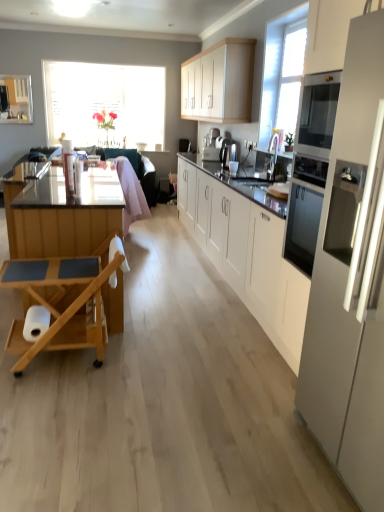
Find the location of `wooden rolling cart at left`. wooden rolling cart at left is located at coordinates (64, 301).

The image size is (384, 512). What are the coordinates of `white glossy refrigerator at right` in the screenshot? It's located at tap(351, 281).

The width and height of the screenshot is (384, 512). Find the location of `white glossy sink at center`. white glossy sink at center is located at coordinates (266, 166).

Image resolution: width=384 pixels, height=512 pixels. Describe the element at coordinates (131, 194) in the screenshot. I see `pink fabric swivel chair at center` at that location.

The height and width of the screenshot is (512, 384). I want to click on translucent glass window at upper left, so click(x=104, y=103).

This screenshot has height=512, width=384. Find the location of `wooden rolling cart at left`. wooden rolling cart at left is located at coordinates (64, 301).

Does satin silver coffee machine at center have a smaller size compared to white matte cabinet at center, which ranks as the second cabinetry in top-to-bottom order?

Correct, satin silver coffee machine at center occupies less space than white matte cabinet at center, which ranks as the second cabinetry in top-to-bottom order.

How distant is satin silver coffee machine at center from white matte cabinet at center, which ranks as the second cabinetry in top-to-bottom order?

satin silver coffee machine at center and white matte cabinet at center, which ranks as the second cabinetry in top-to-bottom order, are 3.47 feet apart.

Can you confirm if satin silver coffee machine at center is shorter than white matte cabinet at center, placed as the first cabinetry when sorted from bottom to top?

Correct, satin silver coffee machine at center is not as tall as white matte cabinet at center, placed as the first cabinetry when sorted from bottom to top.

From the image's perspective, between satin silver coffee machine at center and white matte cabinet at center, which ranks as the second cabinetry in top-to-bottom order, who is located below?

white matte cabinet at center, which ranks as the second cabinetry in top-to-bottom order, is shown below in the image.

Considering the sizes of objects white matte cabinet at center, which ranks as the second cabinetry in top-to-bottom order, and white glossy refrigerator at right in the image provided, who is taller, white matte cabinet at center, which ranks as the second cabinetry in top-to-bottom order, or white glossy refrigerator at right?

white glossy refrigerator at right is taller.

Is white matte cabinet at center, placed as the first cabinetry when sorted from bottom to top, completely or partially outside of white glossy refrigerator at right?

Absolutely, white matte cabinet at center, placed as the first cabinetry when sorted from bottom to top, is external to white glossy refrigerator at right.

Which is closer, [282,220] or [380,286]?

Point [282,220] appears to be farther away from the viewer than point [380,286].

From a real-world perspective, between white matte cabinet at center, which ranks as the second cabinetry in top-to-bottom order, and white glossy refrigerator at right, who is vertically higher?

white glossy refrigerator at right, from a real-world perspective.

Is satin silver coffee machine at center with white glossy refrigerator at right?

No.

From a real-world perspective, between satin silver coffee machine at center and white glossy refrigerator at right, who is vertically lower?

white glossy refrigerator at right.

In the scene shown: From the image's perspective, which is above, satin silver coffee machine at center or white glossy refrigerator at right?

satin silver coffee machine at center.

Which point is more forward, (x=233, y=141) or (x=368, y=31)?

Positioned in front is point (x=368, y=31).

From the image's perspective, which is below, white matte cabinet at center, which ranks as the second cabinetry in top-to-bottom order, or translucent glass window at upper left?

white matte cabinet at center, which ranks as the second cabinetry in top-to-bottom order.

Can you confirm if white matte cabinet at center, placed as the first cabinetry when sorted from bottom to top, is positioned to the right of translucent glass window at upper left?

Yes, white matte cabinet at center, placed as the first cabinetry when sorted from bottom to top, is to the right of translucent glass window at upper left.

Identify the location of the 2nd cabinetry positioned below the translucent glass window at upper left (from the image's perspective). The height and width of the screenshot is (512, 384). (246, 250).

Between white matte cabinet at center, which ranks as the second cabinetry in top-to-bottom order, and translucent glass window at upper left, which one is positioned behind?

translucent glass window at upper left is more distant.

Considering the sizes of objects wooden rolling cart at left and satin silver coffee machine at center in the image provided, who is smaller, wooden rolling cart at left or satin silver coffee machine at center?

satin silver coffee machine at center is smaller.

Which object is further away from the camera taking this photo, wooden rolling cart at left or satin silver coffee machine at center?

satin silver coffee machine at center is further from the camera.

From the image's perspective, is wooden rolling cart at left above or below satin silver coffee machine at center?

wooden rolling cart at left is situated lower than satin silver coffee machine at center in the image.

Is wooden rolling cart at left turned away from satin silver coffee machine at center?

No.

Considering the sizes of objects white matte cabinet at upper center, positioned as the 1th cabinetry in top-to-bottom order, and satin silver coffee machine at center in the image provided, who is taller, white matte cabinet at upper center, positioned as the 1th cabinetry in top-to-bottom order, or satin silver coffee machine at center?

With more height is white matte cabinet at upper center, positioned as the 1th cabinetry in top-to-bottom order.

Is white matte cabinet at upper center, which is the 2th cabinetry from bottom to top, directly adjacent to satin silver coffee machine at center?

No, white matte cabinet at upper center, which is the 2th cabinetry from bottom to top, is not beside satin silver coffee machine at center.

Looking at this image, from the image's perspective, is white matte cabinet at upper center, which is the 2th cabinetry from bottom to top, located above satin silver coffee machine at center?

Yes, from the image's perspective, white matte cabinet at upper center, which is the 2th cabinetry from bottom to top, is above satin silver coffee machine at center.

Does white matte cabinet at upper center, positioned as the 1th cabinetry in top-to-bottom order, turn towards satin silver coffee machine at center?

No.

Could wooden rolling cart at left be considered to be inside white glossy sink at center?

No, wooden rolling cart at left is not a part of white glossy sink at center.

Is white glossy sink at center not near wooden rolling cart at left?

Indeed, white glossy sink at center is not near wooden rolling cart at left.

From the image's perspective, relative to wooden rolling cart at left, is white glossy sink at center above or below?

Based on their image positions, white glossy sink at center is located above wooden rolling cart at left.

You are a GUI agent. You are given a task and a screenshot of the screen. Output one action in this format:
    pyautogui.click(x=<x>, y=<y>)
    Task: Click on the cabinetry in front of the satin silver coffee machine at center
    
    Given the screenshot: What is the action you would take?
    pyautogui.click(x=246, y=250)

Find the location of a particular element. The width and height of the screenshot is (384, 512). cabinetry that is the 1st one when counting backward from the white glossy refrigerator at right is located at coordinates point(246,250).

Consider the image. From the image, which object appears to be nearer to white glossy sink at center, white matte cabinet at center, which ranks as the second cabinetry in top-to-bottom order, or translucent glass window at upper left?

Based on the image, white matte cabinet at center, which ranks as the second cabinetry in top-to-bottom order, appears to be nearer to white glossy sink at center.

Based on their spatial positions, is white glossy sink at center or wooden rolling cart at left further from pink fabric swivel chair at center?

wooden rolling cart at left is positioned further to the anchor pink fabric swivel chair at center.

Considering their positions, is white matte cabinet at upper center, which is the 2th cabinetry from bottom to top, positioned closer to white matte cabinet at center, which ranks as the second cabinetry in top-to-bottom order, than wooden rolling cart at left?

The object closer to white matte cabinet at center, which ranks as the second cabinetry in top-to-bottom order, is white matte cabinet at upper center, which is the 2th cabinetry from bottom to top.

When comparing their distances from white glossy refrigerator at right, does pink fabric swivel chair at center or satin silver coffee machine at center seem further?

Based on the image, pink fabric swivel chair at center appears to be further to white glossy refrigerator at right.

When comparing their distances from wooden rolling cart at left, does pink fabric swivel chair at center or white glossy refrigerator at right seem closer?

white glossy refrigerator at right.

When comparing their distances from satin silver coffee machine at center, does translucent glass window at upper left or white glossy sink at center seem closer?

white glossy sink at center is positioned closer to the anchor satin silver coffee machine at center.

When comparing their distances from white glossy sink at center, does white glossy refrigerator at right or satin silver coffee machine at center seem further?

Based on the image, white glossy refrigerator at right appears to be further to white glossy sink at center.

Considering their positions, is translucent glass window at upper left positioned closer to pink fabric swivel chair at center than white glossy refrigerator at right?

The object closer to pink fabric swivel chair at center is translucent glass window at upper left.

The width and height of the screenshot is (384, 512). What are the coordinates of `coffee machine located between wooden rolling cart at left and white matte cabinet at upper center, which is the 2th cabinetry from bottom to top, in the depth direction` in the screenshot? It's located at coord(228,152).

Locate an element on the screen. The height and width of the screenshot is (512, 384). coffee machine between pink fabric swivel chair at center and white glossy sink at center in the horizontal direction is located at coordinates (228, 152).

Where is `cabinetry between white glossy refrigerator at right and white matte cabinet at upper center, which is the 2th cabinetry from bottom to top, from front to back`? This screenshot has height=512, width=384. cabinetry between white glossy refrigerator at right and white matte cabinet at upper center, which is the 2th cabinetry from bottom to top, from front to back is located at coordinates (246, 250).

The width and height of the screenshot is (384, 512). I want to click on cabinetry between white matte cabinet at center, which ranks as the second cabinetry in top-to-bottom order, and pink fabric swivel chair at center, along the z-axis, so click(219, 82).